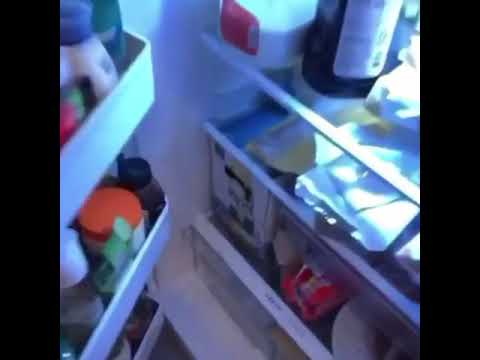
Image resolution: width=480 pixels, height=360 pixels. In order to click on bottle in this screenshot , I will do `click(339, 83)`.